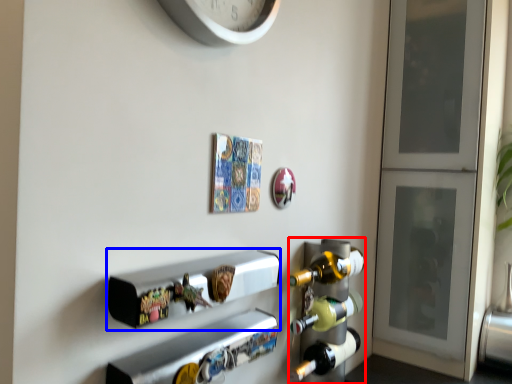
Question: Which of the following is the farthest to the observer, wine rack (highlighted by a red box) or shelf (highlighted by a blue box)?

Choices:
 (A) wine rack
 (B) shelf

Answer: (A)